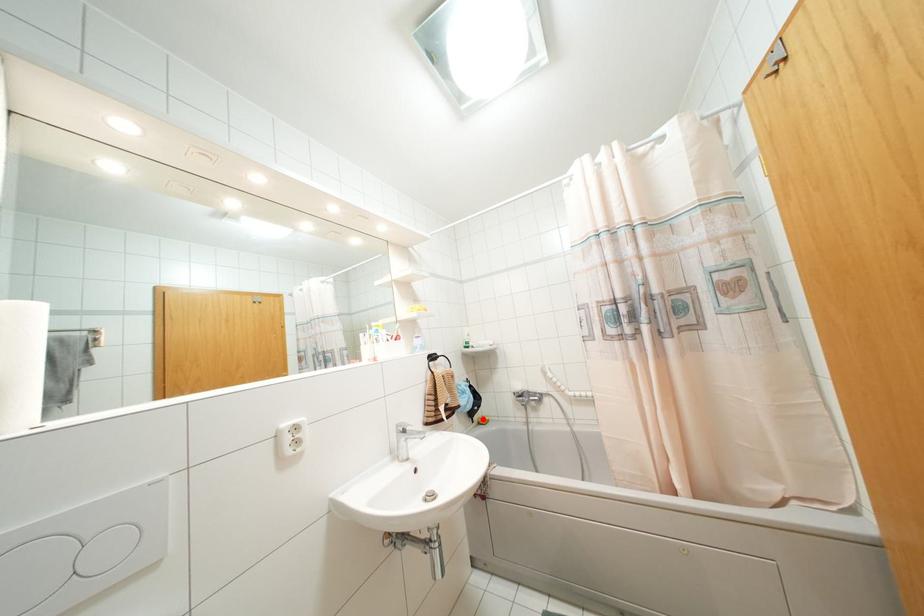
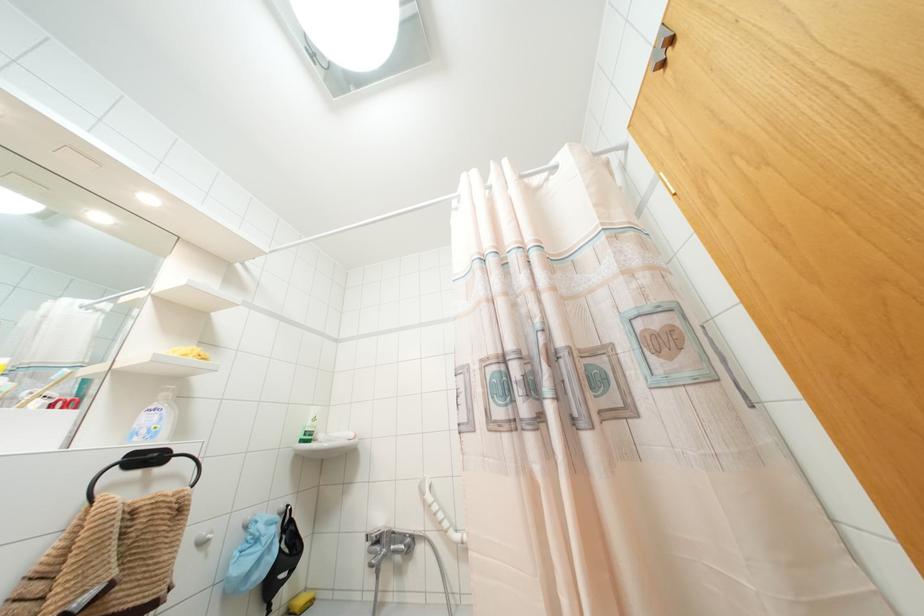
Question: I am providing you with two images of the same scene from different viewpoints. A red point is marked on the first image. At the location where the point appears in image 1, is it still visible in image 2?

Choices:
 (A) Yes
 (B) No

Answer: (A)